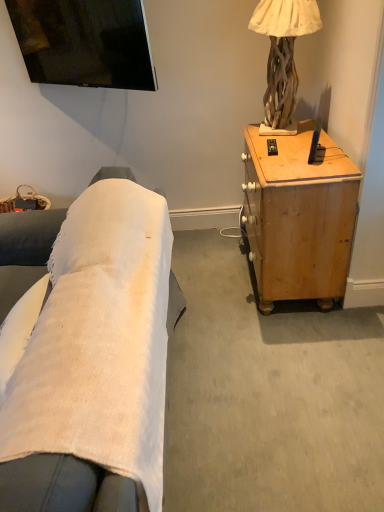
What are the coordinates of `free space in front of natural wood lamp at upper right` in the screenshot? It's located at (293, 147).